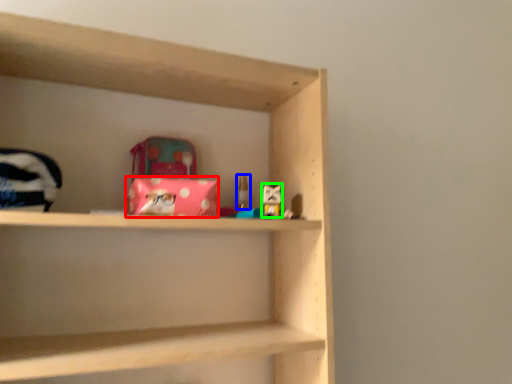
Question: Based on their relative distances, which object is farther from material (highlighted by a red box)? Choose from toy (highlighted by a blue box) and toy (highlighted by a green box).

Choices:
 (A) toy
 (B) toy

Answer: (A)